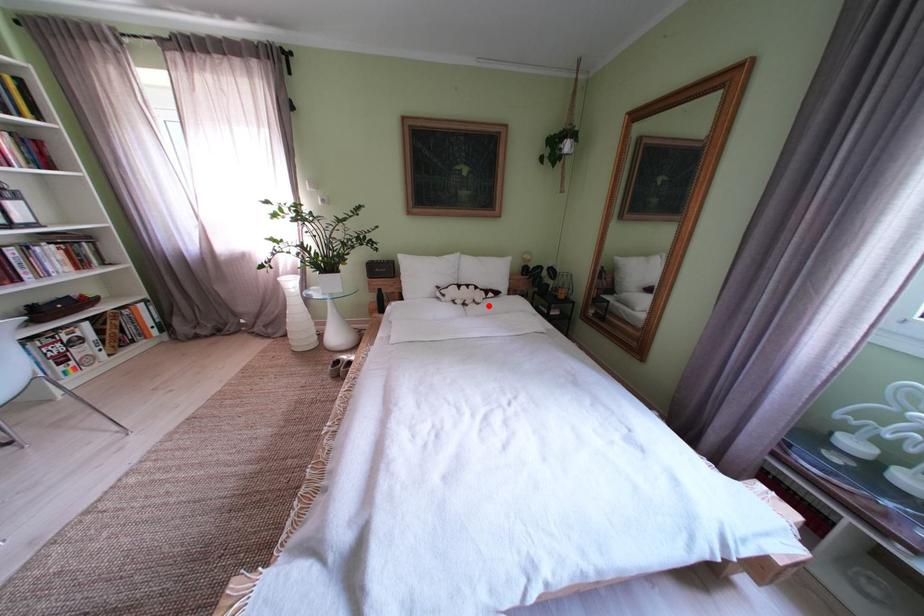
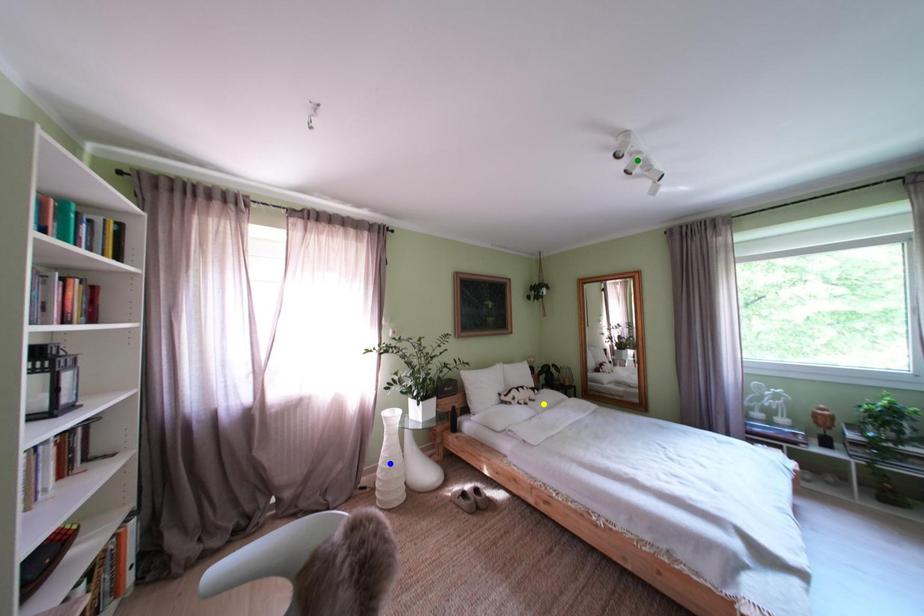
Question: I am providing you with two images of the same scene from different viewpoints. A red point is marked on the first image. You are given multiple points on the second image. Which mark in image 2 goes with the point in image 1?

Choices:
 (A) yellow point
 (B) blue point
 (C) green point

Answer: (A)